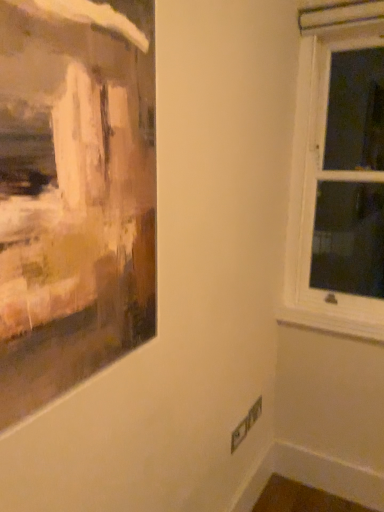
Question: From a real-world perspective, is white wooden window at right located higher than white painted wood at lower right?

Choices:
 (A) yes
 (B) no

Answer: (A)

Question: Can you confirm if white wooden window at right is smaller than white painted wood at lower right?

Choices:
 (A) yes
 (B) no

Answer: (B)

Question: Does white wooden window at right have a greater width compared to white painted wood at lower right?

Choices:
 (A) yes
 (B) no

Answer: (A)

Question: Is the position of white wooden window at right more distant than that of white painted wood at lower right?

Choices:
 (A) no
 (B) yes

Answer: (A)

Question: From the image's perspective, is white wooden window at right on white painted wood at lower right?

Choices:
 (A) no
 (B) yes

Answer: (B)

Question: Does white wooden window at right touch white painted wood at lower right?

Choices:
 (A) yes
 (B) no

Answer: (B)

Question: From a real-world perspective, is white painted wood at lower right positioned under white wooden window at right based on gravity?

Choices:
 (A) yes
 (B) no

Answer: (A)

Question: Is white painted wood at lower right shorter than white wooden window at right?

Choices:
 (A) no
 (B) yes

Answer: (B)

Question: Is white painted wood at lower right aimed at white wooden window at right?

Choices:
 (A) yes
 (B) no

Answer: (B)

Question: Considering the relative sizes of white painted wood at lower right and white wooden window at right in the image provided, is white painted wood at lower right thinner than white wooden window at right?

Choices:
 (A) yes
 (B) no

Answer: (A)

Question: Is white painted wood at lower right not near white wooden window at right?

Choices:
 (A) yes
 (B) no

Answer: (B)

Question: From a real-world perspective, is white painted wood at lower right physically above white wooden window at right?

Choices:
 (A) no
 (B) yes

Answer: (A)

Question: From a real-world perspective, is white painted wood at lower right positioned above or below white wooden window at right?

Choices:
 (A) above
 (B) below

Answer: (B)